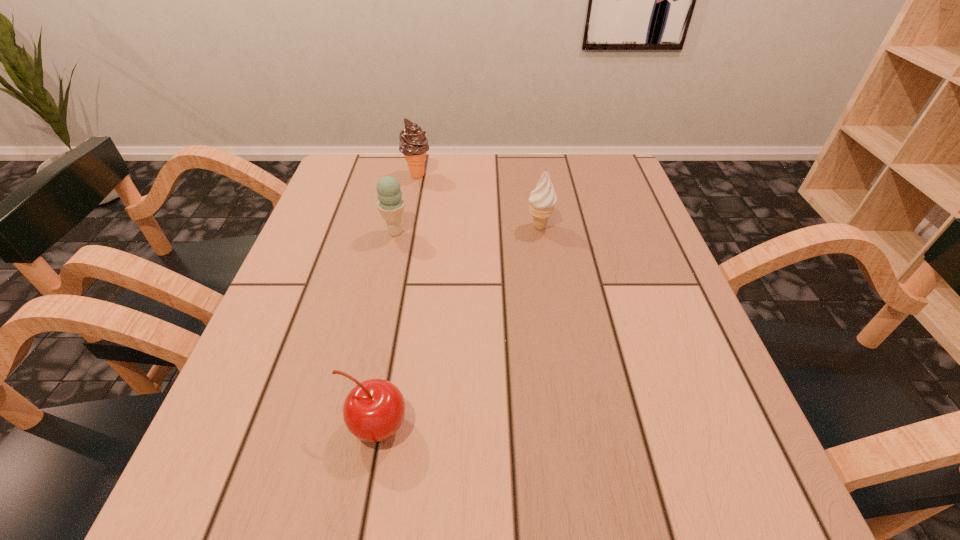
Identify the location of free space at the far edge of the desktop. (420, 183).

At what (x,y) coordinates should I click in order to perform the action: click on free location at the near edge of the desktop. Please return your answer as a coordinate pair (x, y). This screenshot has width=960, height=540. Looking at the image, I should click on (324, 494).

Find the location of a particular element. The image size is (960, 540). vacant space at the right edge is located at coordinates (595, 223).

This screenshot has width=960, height=540. In the image, there is a desktop. Find the location of `free region at the far left corner`. free region at the far left corner is located at coordinates (356, 185).

In the image, there is a desktop. What are the coordinates of `vacant space at the near left corner` in the screenshot? It's located at (213, 509).

This screenshot has width=960, height=540. Find the location of `vacant space at the far right corner of the desktop`. vacant space at the far right corner of the desktop is located at coordinates (585, 187).

You are a GUI agent. You are given a task and a screenshot of the screen. Output one action in this format:
    pyautogui.click(x=<x>, y=<y>)
    Task: Click on the free space between the rightmost object and the farthest ice cream
    
    Given the screenshot: What is the action you would take?
    pyautogui.click(x=478, y=201)

I want to click on blank region between the rightmost object and the shortest object, so click(x=458, y=327).

The image size is (960, 540). I want to click on free space between the shortest object and the farthest ice cream, so click(x=396, y=301).

I want to click on vacant space that is in between the shortest object and the rightmost object, so click(x=458, y=327).